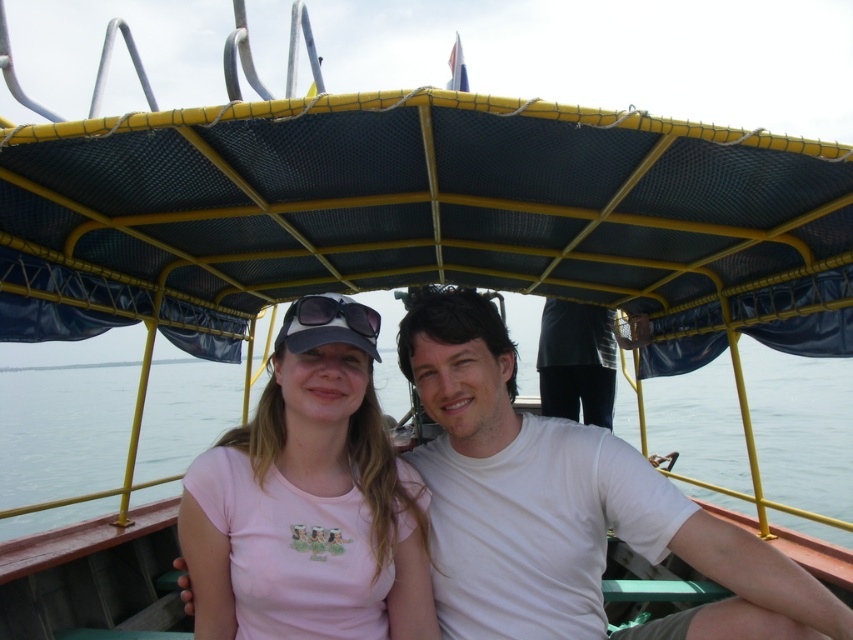
Is point (618, 388) more distant than point (589, 408)?

Yes, point (618, 388) is behind point (589, 408).

The image size is (853, 640). Describe the element at coordinates (62, 429) in the screenshot. I see `transparent water at center` at that location.

Which is behind, point (28, 378) or point (607, 420)?

Point (28, 378)

Find the location of a particular element. transparent water at center is located at coordinates point(62,429).

Who is lower down, pink matte t-shirt at center or transparent water at center?

transparent water at center is lower down.

Can you confirm if pink matte t-shirt at center is thinner than transparent water at center?

Correct, pink matte t-shirt at center's width is less than transparent water at center's.

Locate an element on the screen. This screenshot has height=640, width=853. pink matte t-shirt at center is located at coordinates (309, 500).

Locate an element on the screen. pink matte t-shirt at center is located at coordinates (309, 500).

Does white matte t-shirt at center have a smaller size compared to transparent water at center?

Correct, white matte t-shirt at center occupies less space than transparent water at center.

Looking at this image, who is shorter, white matte t-shirt at center or transparent water at center?

white matte t-shirt at center

Between point (463, 620) and point (781, 381), which one is positioned behind?

Point (781, 381)

What are the coordinates of `white matte t-shirt at center` in the screenshot? It's located at (564, 506).